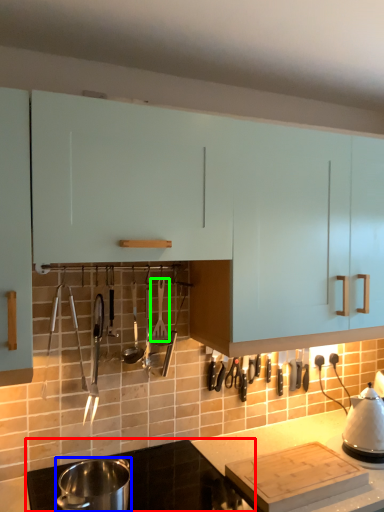
Question: Which object is the farthest from countertop (highlighted by a red box)? Choose among these: kitchen appliance (highlighted by a blue box) or silverware (highlighted by a green box).

Choices:
 (A) kitchen appliance
 (B) silverware

Answer: (B)